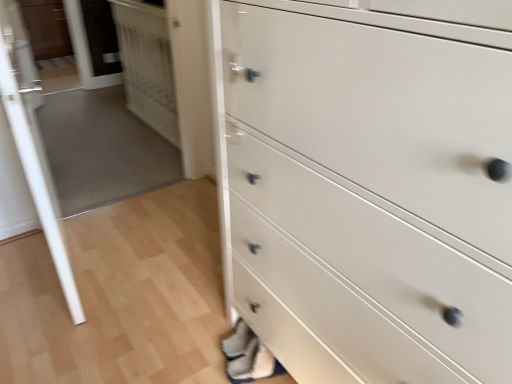
At what (x,y) coordinates should I click in order to perform the action: click on free spot to the left of white glossy door at upper left. Please return your answer as a coordinate pair (x, y). This screenshot has height=384, width=512. Looking at the image, I should click on (100, 140).